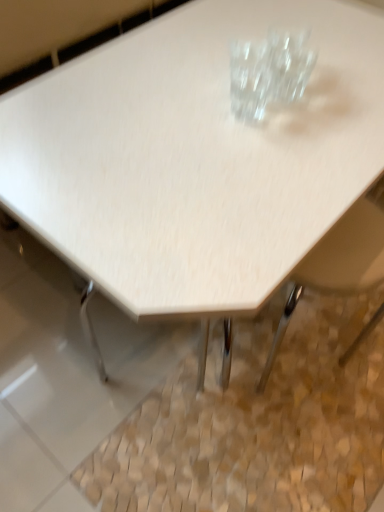
At what (x,y) coordinates should I click in order to perform the action: click on free point in front of metallic silver chair at lower right. Please return your answer as a coordinate pair (x, y). The height and width of the screenshot is (512, 384). Looking at the image, I should click on coord(287,472).